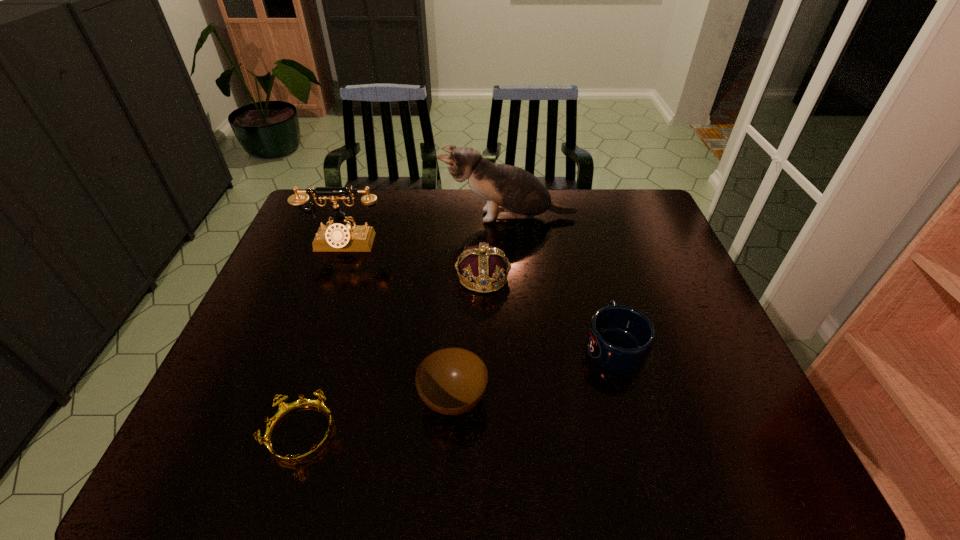
The width and height of the screenshot is (960, 540). In order to click on vacant space at the near right corner of the desktop in this screenshot , I will do `click(743, 456)`.

Where is `vacant area between the mug and the bowl`? This screenshot has height=540, width=960. vacant area between the mug and the bowl is located at coordinates (534, 372).

This screenshot has width=960, height=540. In order to click on empty space between the left crown and the bowl in this screenshot , I will do `click(378, 416)`.

This screenshot has width=960, height=540. What are the coordinates of `empty space that is in between the farthest object and the bowl` in the screenshot? It's located at [x=481, y=308].

This screenshot has width=960, height=540. Identify the location of free spot between the tallest object and the bowl. (481, 308).

Find the location of a particular element. This screenshot has height=540, width=960. unoccupied position between the mug and the third farthest object is located at coordinates (549, 311).

This screenshot has height=540, width=960. What are the coordinates of `vacant space that's between the tallest object and the taller crown` in the screenshot? It's located at (496, 247).

This screenshot has height=540, width=960. What are the coordinates of `free spot between the right crown and the mug` in the screenshot? It's located at (549, 311).

The image size is (960, 540). I want to click on vacant point located between the bowl and the tallest object, so click(x=481, y=308).

Where is `empty space that is in between the second farthest object and the cat`? Image resolution: width=960 pixels, height=540 pixels. empty space that is in between the second farthest object and the cat is located at coordinates (426, 231).